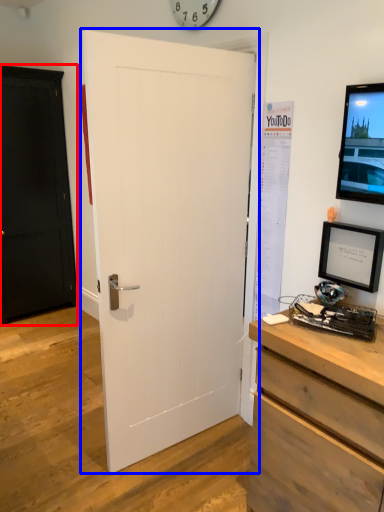
Question: Among these objects, which one is nearest to the camera, door (highlighted by a red box) or door (highlighted by a blue box)?

Choices:
 (A) door
 (B) door

Answer: (B)